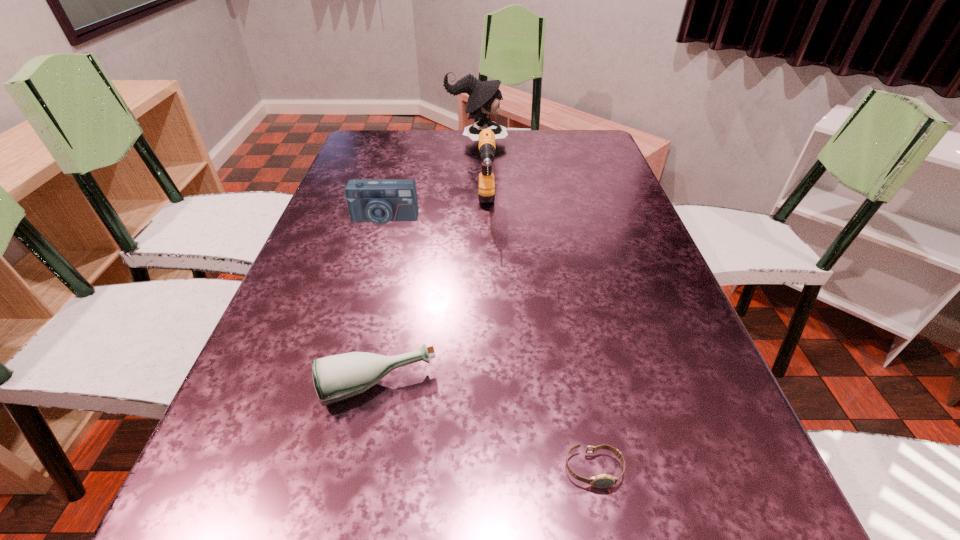
In the image, there is a desktop. Where is `vacant area at the far right corner`? The width and height of the screenshot is (960, 540). vacant area at the far right corner is located at coordinates (606, 160).

This screenshot has width=960, height=540. I want to click on free space between the third shortest object and the drill, so click(x=435, y=212).

This screenshot has height=540, width=960. What are the coordinates of `free spot between the second nearest object and the watch` in the screenshot? It's located at (486, 428).

Find the location of a particular element. This screenshot has width=960, height=540. free space between the bottle and the third tallest object is located at coordinates (380, 302).

You are a GUI agent. You are given a task and a screenshot of the screen. Output one action in this format:
    pyautogui.click(x=<x>, y=<y>)
    Task: Click on the vacant area that lies between the fourth tallest object and the doll
    The height and width of the screenshot is (540, 960).
    Given the screenshot: What is the action you would take?
    pyautogui.click(x=427, y=264)

Locate an element on the screen. This screenshot has height=540, width=960. free space between the third tallest object and the nearest object is located at coordinates (489, 344).

Where is `unoccupied area between the rightmost object and the third tallest object`? Image resolution: width=960 pixels, height=540 pixels. unoccupied area between the rightmost object and the third tallest object is located at coordinates (489, 344).

The height and width of the screenshot is (540, 960). Find the location of `empty space between the second tallest object and the nearest object`. empty space between the second tallest object and the nearest object is located at coordinates (540, 338).

In order to click on object that ranks as the second closest to the rightmost object in this screenshot , I will do `click(486, 186)`.

Locate an element on the screen. This screenshot has height=540, width=960. object that ranks as the third closest to the drill is located at coordinates (338, 377).